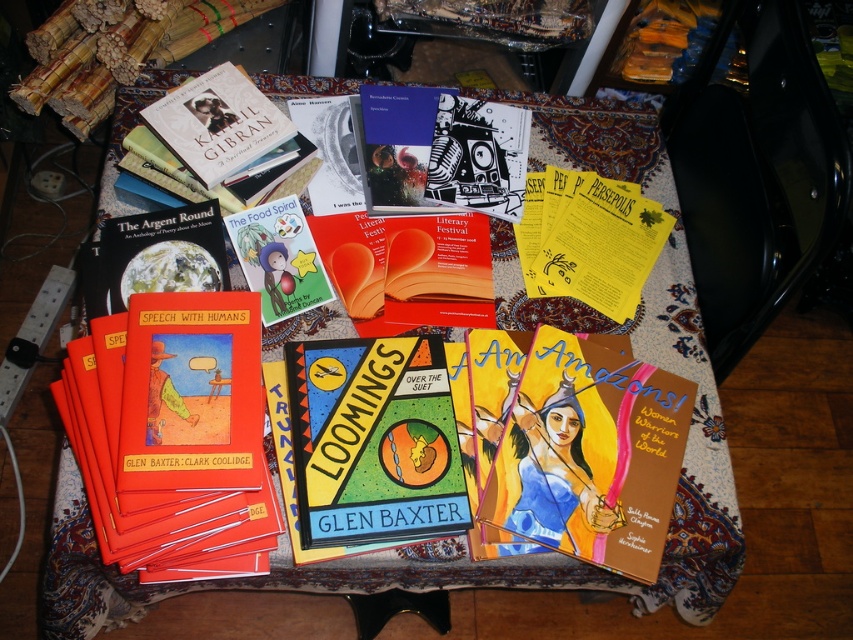
You are standing at the center of the table looking at the arrangement. Which object is located at the coordinates point [184,416]?

The red matte book at lower left is located at the coordinates point [184,416].